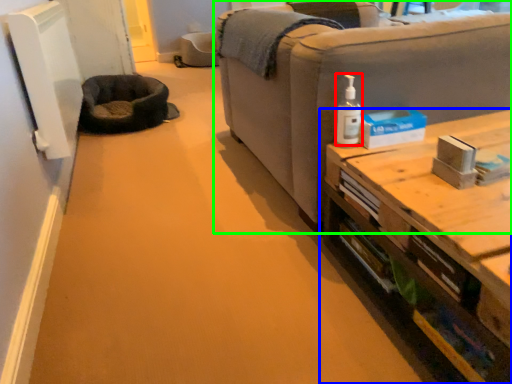
Question: Considering the real-world distances, which object is closest to toiletry (highlighted by a red box)? table (highlighted by a blue box) or studio couch (highlighted by a green box).

Choices:
 (A) table
 (B) studio couch

Answer: (B)